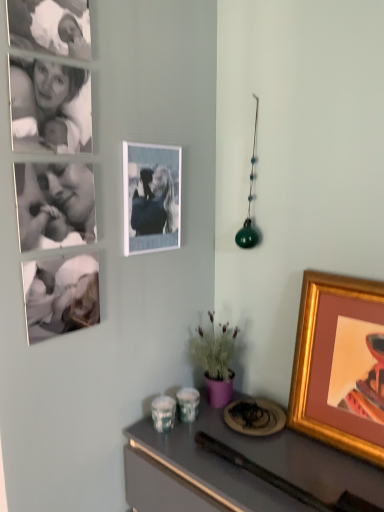
Question: Would you say black and white photograph of a person at upper left contains metallic gray desk at lower right?

Choices:
 (A) no
 (B) yes

Answer: (A)

Question: From the image's perspective, does black and white photograph of a person at upper left appear higher than metallic gray desk at lower right?

Choices:
 (A) yes
 (B) no

Answer: (A)

Question: From the image's perspective, is black and white photograph of a person at upper left located beneath metallic gray desk at lower right?

Choices:
 (A) no
 (B) yes

Answer: (A)

Question: Is black and white photograph of a person at upper left positioned in front of metallic gray desk at lower right?

Choices:
 (A) yes
 (B) no

Answer: (B)

Question: Is black and white photograph of a person at upper left completely or partially outside of metallic gray desk at lower right?

Choices:
 (A) yes
 (B) no

Answer: (A)

Question: In terms of width, does gold-framed picture at right, which ranks as the second picture frame in top-to-bottom order, look wider or thinner when compared to metallic gray desk at lower right?

Choices:
 (A) wide
 (B) thin

Answer: (B)

Question: From the image's perspective, is gold-framed picture at right, which ranks as the second picture frame in top-to-bottom order, above or below metallic gray desk at lower right?

Choices:
 (A) below
 (B) above

Answer: (B)

Question: In the image, is gold-framed picture at right, acting as the 1th picture frame starting from the bottom, positioned in front of or behind metallic gray desk at lower right?

Choices:
 (A) front
 (B) behind

Answer: (B)

Question: Considering the positions of point (306, 425) and point (279, 432), is point (306, 425) closer or farther from the camera than point (279, 432)?

Choices:
 (A) farther
 (B) closer

Answer: (B)

Question: From the image's perspective, is matte white photo frame at upper center, which is the 2th picture frame in right-to-left order, located above or below black and white photograph of a person at upper left?

Choices:
 (A) above
 (B) below

Answer: (B)

Question: In terms of height, does matte white photo frame at upper center, which is the 2th picture frame in right-to-left order, look taller or shorter compared to black and white photograph of a person at upper left?

Choices:
 (A) tall
 (B) short

Answer: (A)

Question: Does point [173, 192] appear closer or farther from the camera than point [54, 124]?

Choices:
 (A) closer
 (B) farther

Answer: (B)

Question: Relative to black and white photograph of a person at upper left, is matte white photo frame at upper center, the second picture frame positioned from the bottom, in front or behind?

Choices:
 (A) behind
 (B) front

Answer: (A)

Question: From the image's perspective, relative to metallic gray desk at lower right, is matte white photo frame at upper center, the first picture frame in the top-to-bottom sequence, above or below?

Choices:
 (A) above
 (B) below

Answer: (A)

Question: From their relative heights in the image, would you say matte white photo frame at upper center, the first picture frame in the top-to-bottom sequence, is taller or shorter than metallic gray desk at lower right?

Choices:
 (A) short
 (B) tall

Answer: (A)